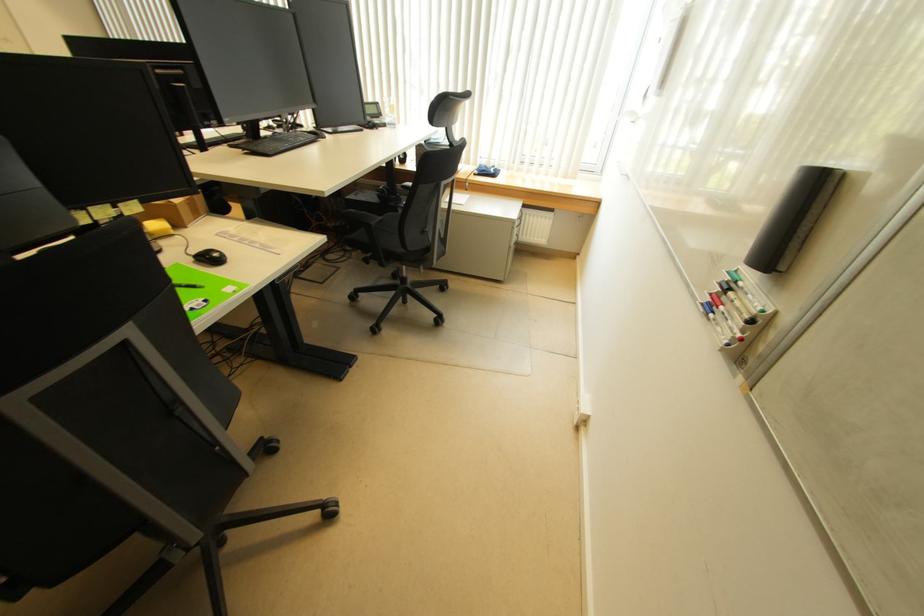
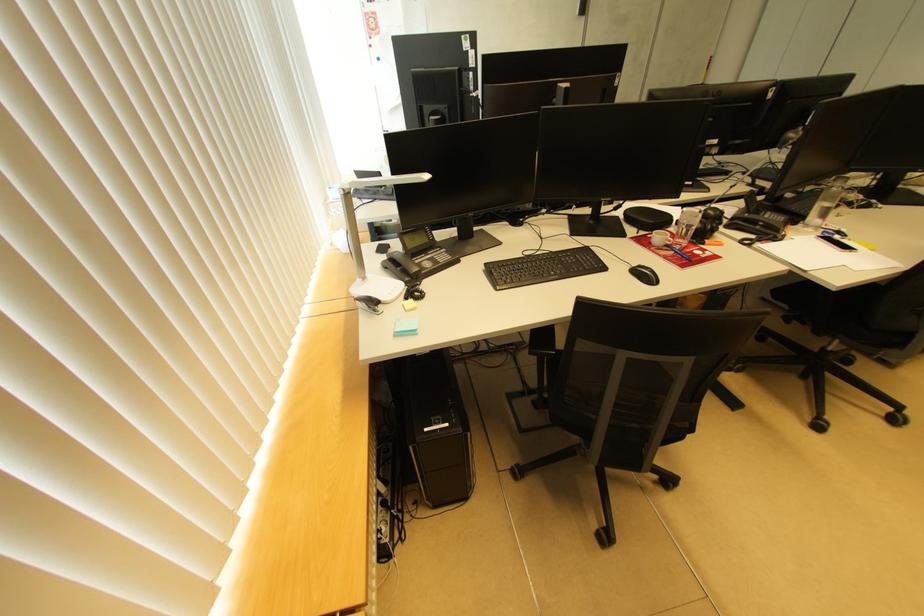
Question: I am providing you with two images of the same scene from different viewpoints. After the viewpoint changes to image2, which objects are now occluded?

Choices:
 (A) black whiteboard marker
 (B) white stapler
 (C) black glasses case
 (D) white quilted cushion

Answer: (A)